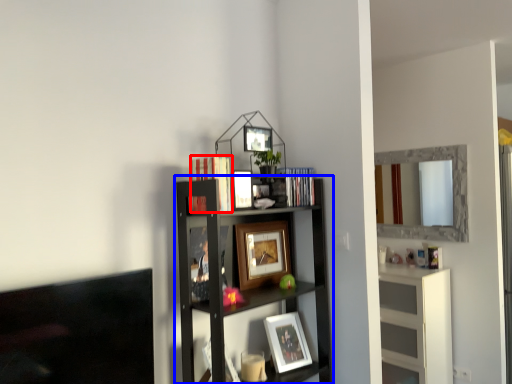
Question: Among these objects, which one is farthest to the camera, book (highlighted by a red box) or shelf (highlighted by a blue box)?

Choices:
 (A) book
 (B) shelf

Answer: (A)